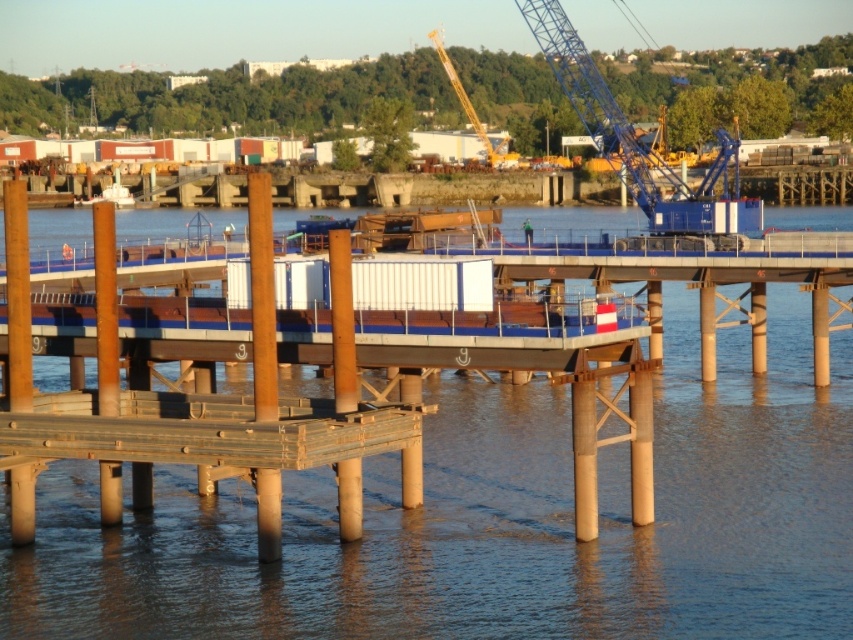
Question: Among these points, which one is nearest to the camera?

Choices:
 (A) (505, 138)
 (B) (775, 554)

Answer: (B)

Question: Is brown wooden water at center smaller than yellow metallic crane at upper center?

Choices:
 (A) no
 (B) yes

Answer: (A)

Question: Among these objects, which one is farthest from the camera?

Choices:
 (A) yellow metallic crane at upper center
 (B) brown wooden water at center

Answer: (A)

Question: Can you confirm if brown wooden water at center is thinner than yellow metallic crane at upper center?

Choices:
 (A) no
 (B) yes

Answer: (A)

Question: Is brown wooden water at center above yellow metallic crane at upper center?

Choices:
 (A) yes
 (B) no

Answer: (B)